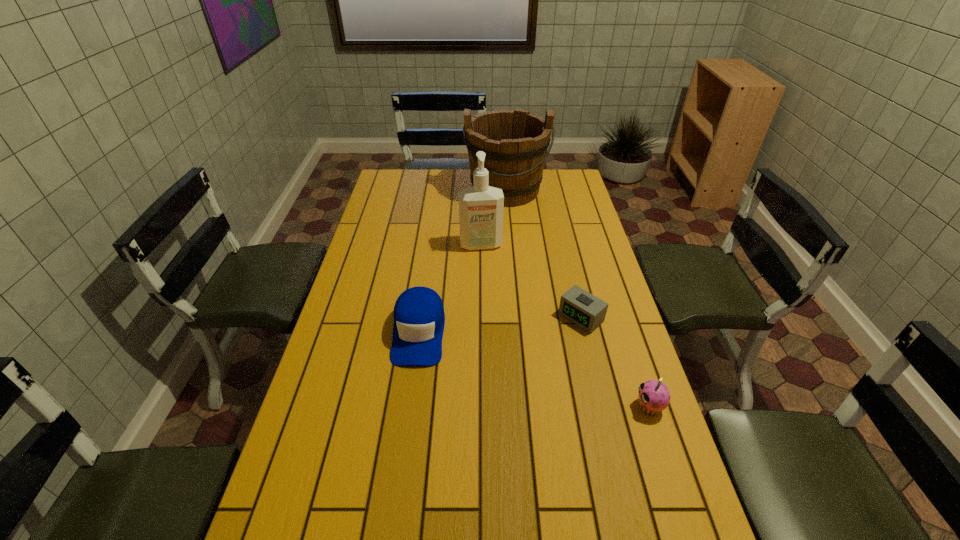
This screenshot has height=540, width=960. I want to click on cupcake that is at the right edge, so click(654, 396).

This screenshot has height=540, width=960. I want to click on alarm clock present at the right edge, so pos(582,308).

At what (x,y) coordinates should I click in order to perform the action: click on wine bucket situated at the right edge. Please return your answer as a coordinate pair (x, y). Looking at the image, I should click on (515, 142).

Where is `object that is positioned at the far right corner`? The image size is (960, 540). object that is positioned at the far right corner is located at coordinates (515, 142).

Locate an element on the screen. The height and width of the screenshot is (540, 960). free space at the far edge of the desktop is located at coordinates (421, 192).

In the image, there is a desktop. At what (x,y) coordinates should I click in order to perform the action: click on vacant space at the left edge. Please return your answer as a coordinate pair (x, y). Looking at the image, I should click on (331, 379).

The image size is (960, 540). What are the coordinates of `vacant space at the right edge` in the screenshot? It's located at (607, 410).

Where is `vacant space at the far left corner`? This screenshot has width=960, height=540. vacant space at the far left corner is located at coordinates (391, 193).

Find the location of a particular element. This screenshot has height=540, width=960. free space at the near right corner of the desktop is located at coordinates (685, 525).

At what (x,y) coordinates should I click in order to perform the action: click on unoccupied area between the leftmost object and the shortest object. Please return your answer as a coordinate pair (x, y). The image size is (960, 540). Looking at the image, I should click on pyautogui.click(x=500, y=325).